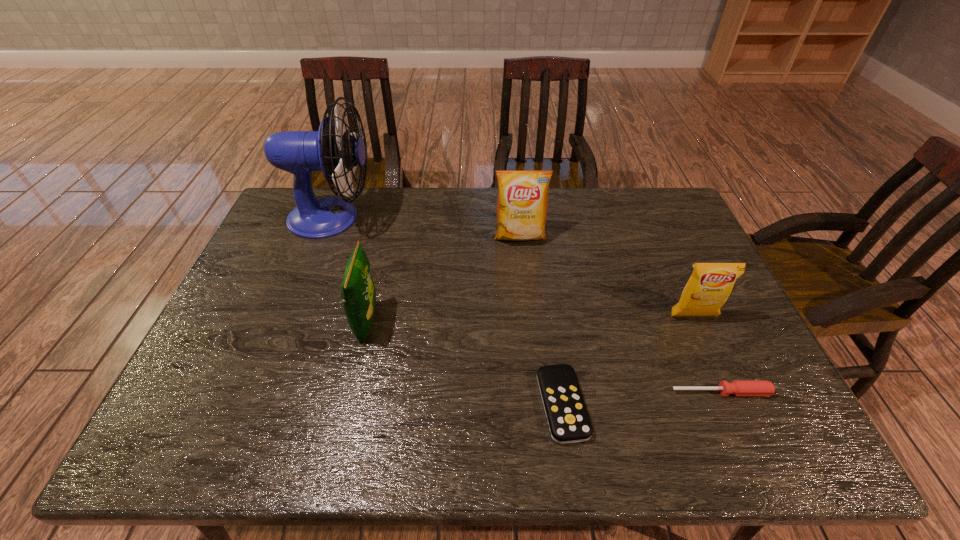
Where is `vacant space that satisfies the following two spatial constraints: 1. on the front-facing side of the second crisp (potato chip) from left to right; 2. on the left side of the screwdriver`? This screenshot has height=540, width=960. vacant space that satisfies the following two spatial constraints: 1. on the front-facing side of the second crisp (potato chip) from left to right; 2. on the left side of the screwdriver is located at coordinates (536, 392).

Identify the location of vacant space that satisfies the following two spatial constraints: 1. on the front-facing side of the remote control; 2. on the right side of the leftmost crisp (potato chip). tap(348, 404).

Identify the location of blank space that satisfies the following two spatial constraints: 1. on the back side of the screwdriver; 2. on the front-facing side of the leftmost crisp (potato chip). The width and height of the screenshot is (960, 540). 691,322.

Identify the location of vacant space that satisfies the following two spatial constraints: 1. on the back side of the remote control; 2. on the front-facing side of the leftmost crisp (potato chip). This screenshot has width=960, height=540. (550, 322).